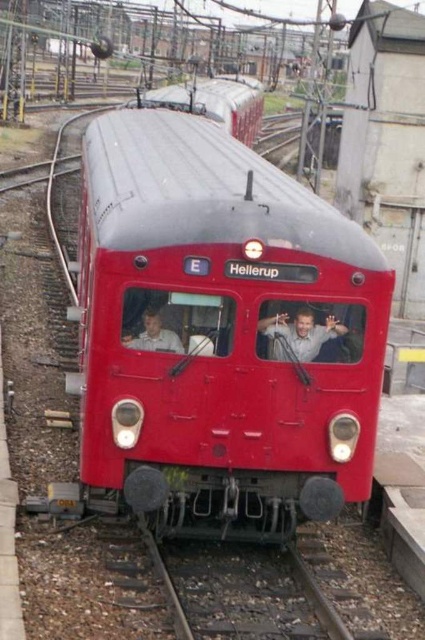
Question: Estimate the real-world distances between objects in this image. Which object is farther from the matte red train at center?

Choices:
 (A) light blue fabric shirt at center
 (B) light beige shirt at left

Answer: (B)

Question: Which point is farther to the camera?

Choices:
 (A) light blue fabric shirt at center
 (B) light beige shirt at left

Answer: (A)

Question: Does matte red train at center appear on the right side of light blue fabric shirt at center?

Choices:
 (A) yes
 (B) no

Answer: (B)

Question: Among these objects, which one is farthest from the camera?

Choices:
 (A) light beige shirt at left
 (B) matte red train at center

Answer: (B)

Question: Can you confirm if matte red train at center is positioned below light beige shirt at left?

Choices:
 (A) no
 (B) yes

Answer: (B)

Question: Where is matte red train at center located in relation to light beige shirt at left in the image?

Choices:
 (A) right
 (B) left

Answer: (A)